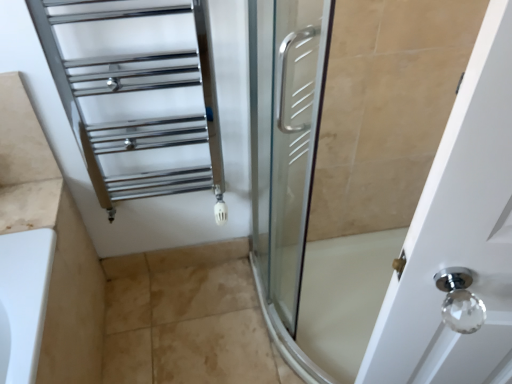
Question: From a real-world perspective, is chrome/metallic towel rack at upper left positioned over beige tile at lower center based on gravity?

Choices:
 (A) yes
 (B) no

Answer: (A)

Question: Considering the relative sizes of chrome/metallic towel rack at upper left and beige tile at lower center in the image provided, is chrome/metallic towel rack at upper left thinner than beige tile at lower center?

Choices:
 (A) yes
 (B) no

Answer: (B)

Question: Can you confirm if chrome/metallic towel rack at upper left is shorter than beige tile at lower center?

Choices:
 (A) no
 (B) yes

Answer: (A)

Question: Is the position of chrome/metallic towel rack at upper left less distant than that of beige tile at lower center?

Choices:
 (A) yes
 (B) no

Answer: (A)

Question: Does chrome/metallic towel rack at upper left appear on the left side of beige tile at lower center?

Choices:
 (A) yes
 (B) no

Answer: (A)

Question: From the image's perspective, would you say chrome/metallic towel rack at upper left is shown under beige tile at lower center?

Choices:
 (A) yes
 (B) no

Answer: (B)

Question: Can you confirm if beige tile at lower center is bigger than chrome/metallic towel rack at upper left?

Choices:
 (A) no
 (B) yes

Answer: (A)

Question: From a real-world perspective, is beige tile at lower center on chrome/metallic towel rack at upper left?

Choices:
 (A) yes
 (B) no

Answer: (B)

Question: Is beige tile at lower center placed right next to chrome/metallic towel rack at upper left?

Choices:
 (A) yes
 (B) no

Answer: (B)

Question: Is beige tile at lower center facing towards chrome/metallic towel rack at upper left?

Choices:
 (A) yes
 (B) no

Answer: (B)

Question: Is beige tile at lower center smaller than chrome/metallic towel rack at upper left?

Choices:
 (A) no
 (B) yes

Answer: (B)

Question: From the image's perspective, is beige tile at lower center below chrome/metallic towel rack at upper left?

Choices:
 (A) no
 (B) yes

Answer: (B)

Question: Considering the positions of chrome/metallic towel rack at upper left and beige tile at lower center in the image, is chrome/metallic towel rack at upper left taller or shorter than beige tile at lower center?

Choices:
 (A) short
 (B) tall

Answer: (B)